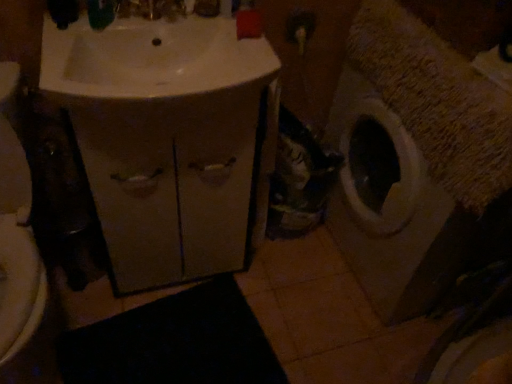
What are the coordinates of `spots to the right of matte beige cabinet at center` in the screenshot? It's located at (278, 295).